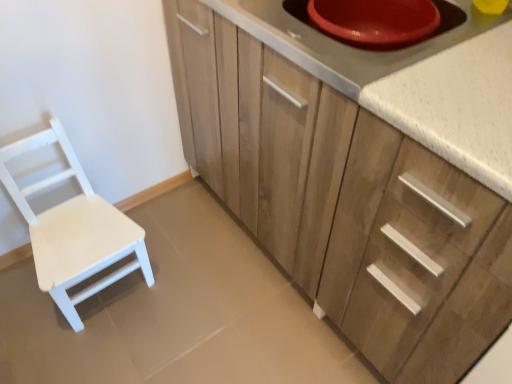
Describe the element at coordinates (413, 81) in the screenshot. The height and width of the screenshot is (384, 512). I see `white speckled countertop at upper right` at that location.

The height and width of the screenshot is (384, 512). I want to click on white matte wood chair at left, so click(x=74, y=230).

Considering the sizes of objects white matte wood chair at left and wooden cabinet at center in the image provided, who is shorter, white matte wood chair at left or wooden cabinet at center?

white matte wood chair at left.

In the scene shown: Measure the distance from white matte wood chair at left to wooden cabinet at center.

white matte wood chair at left and wooden cabinet at center are 23.85 inches apart.

Is white matte wood chair at left next to wooden cabinet at center and touching it?

white matte wood chair at left and wooden cabinet at center are not in contact.

Is white matte wood chair at left at the back of red plastic bowl at upper right?

red plastic bowl at upper right is not turned away from white matte wood chair at left.

In the scene shown: Is red plastic bowl at upper right outside of white matte wood chair at left?

Indeed, red plastic bowl at upper right is completely outside white matte wood chair at left.

From the picture: Looking at the image, does red plastic bowl at upper right seem bigger or smaller compared to white matte wood chair at left?

red plastic bowl at upper right is smaller than white matte wood chair at left.

Considering the positions of objects red plastic bowl at upper right and white matte wood chair at left in the image provided, who is in front, red plastic bowl at upper right or white matte wood chair at left?

red plastic bowl at upper right is in front.

Considering the sizes of wooden cabinet at center and white matte wood chair at left in the image, is wooden cabinet at center wider or thinner than white matte wood chair at left?

wooden cabinet at center is wider than white matte wood chair at left.

From the image's perspective, which one is positioned higher, wooden cabinet at center or white matte wood chair at left?

wooden cabinet at center is shown above in the image.

Measure the distance between wooden cabinet at center and white matte wood chair at left.

wooden cabinet at center and white matte wood chair at left are 60.58 centimeters apart.

From their relative heights in the image, would you say wooden cabinet at center is taller or shorter than white matte wood chair at left?

Considering their sizes, wooden cabinet at center has more height than white matte wood chair at left.

Is red plastic bowl at upper right positioned before white speckled countertop at upper right?

No, red plastic bowl at upper right is further to the viewer.

Can you confirm if red plastic bowl at upper right is shorter than white speckled countertop at upper right?

Correct, red plastic bowl at upper right is not as tall as white speckled countertop at upper right.

Is point (288, 28) less distant than point (332, 61)?

That is False.

Is red plastic bowl at upper right aimed at white speckled countertop at upper right?

Yes, red plastic bowl at upper right is turned towards white speckled countertop at upper right.

Which object is positioned more to the right, white speckled countertop at upper right or white matte wood chair at left?

white speckled countertop at upper right.

Is white speckled countertop at upper right taller than white matte wood chair at left?

No.

Based on the photo, from the image's perspective, is white speckled countertop at upper right located above white matte wood chair at left?

Yes.

Does white speckled countertop at upper right contain white matte wood chair at left?

No, white matte wood chair at left is not surrounded by white speckled countertop at upper right.

Is white matte wood chair at left surrounding white speckled countertop at upper right?

No, white speckled countertop at upper right is not surrounded by white matte wood chair at left.

From a real-world perspective, who is located lower, white matte wood chair at left or white speckled countertop at upper right?

→ In real-world perspective, white matte wood chair at left is lower.

Identify the location of countertop above the white matte wood chair at left (from the image's perspective). This screenshot has height=384, width=512. (413, 81).

Can you confirm if white matte wood chair at left is wider than white speckled countertop at upper right?

In fact, white matte wood chair at left might be narrower than white speckled countertop at upper right.

From the image's perspective, which object appears higher, white matte wood chair at left or red plastic bowl at upper right?

red plastic bowl at upper right is shown above in the image.

Is point (70, 148) farther from camera compared to point (374, 65)?

Yes, it is.

Where is `appliance above the white matte wood chair at left (from a real-world perspective)`? The width and height of the screenshot is (512, 384). appliance above the white matte wood chair at left (from a real-world perspective) is located at coordinates (348, 44).

Where is `cabinetry above the white matte wood chair at left (from the image's perspective)`? This screenshot has height=384, width=512. cabinetry above the white matte wood chair at left (from the image's perspective) is located at coordinates (340, 187).

This screenshot has height=384, width=512. What are the coordinates of `chair that is on the left side of red plastic bowl at upper right` in the screenshot? It's located at (74, 230).

Looking at the image, which one is located further to white speckled countertop at upper right, wooden cabinet at center or white matte wood chair at left?

white matte wood chair at left.

Based on their spatial positions, is wooden cabinet at center or red plastic bowl at upper right further from white speckled countertop at upper right?

wooden cabinet at center.

From the image, which object appears to be farther from wooden cabinet at center, white matte wood chair at left or red plastic bowl at upper right?

white matte wood chair at left is positioned further to the anchor wooden cabinet at center.

Estimate the real-world distances between objects in this image. Which object is closer to red plastic bowl at upper right, wooden cabinet at center or white speckled countertop at upper right?

Among the two, white speckled countertop at upper right is located nearer to red plastic bowl at upper right.

When comparing their distances from red plastic bowl at upper right, does white matte wood chair at left or wooden cabinet at center seem closer?

The object closer to red plastic bowl at upper right is wooden cabinet at center.

In the scene shown: Looking at the image, which one is located closer to wooden cabinet at center, white speckled countertop at upper right or red plastic bowl at upper right?

white speckled countertop at upper right is closer to wooden cabinet at center.

When comparing their distances from white matte wood chair at left, does red plastic bowl at upper right or wooden cabinet at center seem further?

red plastic bowl at upper right is positioned further to the anchor white matte wood chair at left.

Considering their positions, is white matte wood chair at left positioned further to white speckled countertop at upper right than wooden cabinet at center?

Based on the image, white matte wood chair at left appears to be further to white speckled countertop at upper right.

At what (x,y) coordinates should I click in order to perform the action: click on appliance between white speckled countertop at upper right and wooden cabinet at center vertically. Please return your answer as a coordinate pair (x, y). The image size is (512, 384). Looking at the image, I should click on (348, 44).

The image size is (512, 384). I want to click on appliance located between white matte wood chair at left and wooden cabinet at center in the left-right direction, so click(x=348, y=44).

This screenshot has width=512, height=384. I want to click on countertop between white matte wood chair at left and wooden cabinet at center, so (413, 81).

I want to click on countertop between white matte wood chair at left and red plastic bowl at upper right from left to right, so click(413, 81).